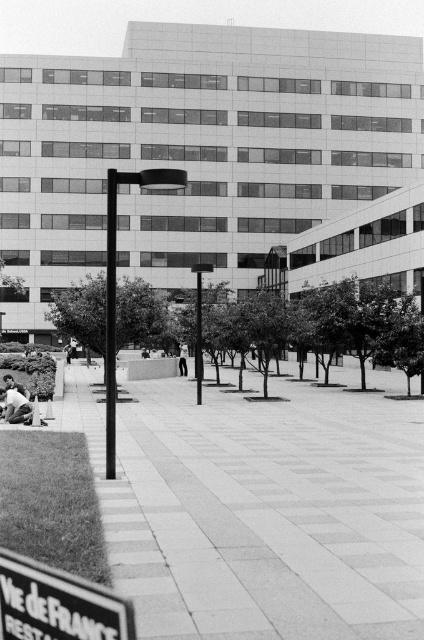
Is smooth concrete pavement at center closer to camera compared to metallic street sign at lower left?

No, smooth concrete pavement at center is further to the viewer.

Describe the element at coordinates (259, 515) in the screenshot. I see `smooth concrete pavement at center` at that location.

Who is more forward, (x=247, y=544) or (x=66, y=632)?

Point (x=66, y=632) is in front.

Locate an element on the screen. The width and height of the screenshot is (424, 640). smooth concrete pavement at center is located at coordinates (259, 515).

Between smooth concrete pavement at center and light skin tone human at lower left, which one is positioned lower?

smooth concrete pavement at center

Does point (334, 513) lie in front of point (22, 404)?

Yes, point (334, 513) is in front of point (22, 404).

I want to click on smooth concrete pavement at center, so click(x=259, y=515).

Is metallic street sign at lower left thinner than light skin tone human at lower left?

Correct, metallic street sign at lower left's width is less than light skin tone human at lower left's.

Can you confirm if metallic street sign at lower left is taller than light skin tone human at lower left?

No, metallic street sign at lower left is not taller than light skin tone human at lower left.

You are a GUI agent. You are given a task and a screenshot of the screen. Output one action in this format:
    pyautogui.click(x=<x>, y=<y>)
    Task: Click on the metallic street sign at lower left
    The width and height of the screenshot is (424, 640).
    Given the screenshot: What is the action you would take?
    pyautogui.click(x=58, y=604)

Locate an element on the screen. This screenshot has height=640, width=424. metallic street sign at lower left is located at coordinates (58, 604).